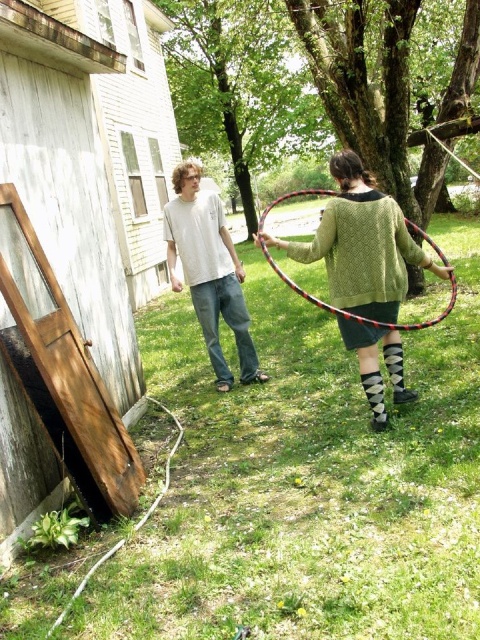
Question: Which object is closer to the camera taking this photo?

Choices:
 (A) white cotton t-shirt at center
 (B) green knitted sweater at center

Answer: (B)

Question: Among these points, which one is nearest to the camera?

Choices:
 (A) (164, 227)
 (B) (444, 273)

Answer: (B)

Question: Is green knitted sweater at center closer to camera compared to white cotton t-shirt at center?

Choices:
 (A) no
 (B) yes

Answer: (B)

Question: Is green knitted sweater at center to the left of white cotton t-shirt at center from the viewer's perspective?

Choices:
 (A) yes
 (B) no

Answer: (B)

Question: Is green knitted sweater at center positioned in front of white cotton t-shirt at center?

Choices:
 (A) yes
 (B) no

Answer: (A)